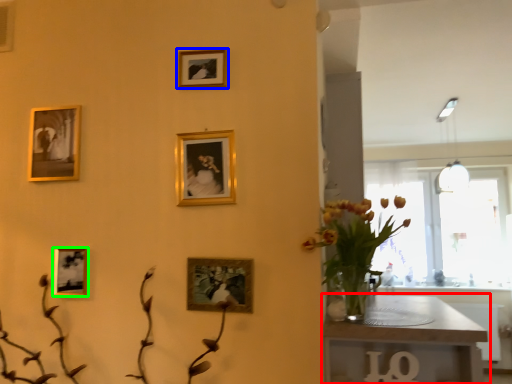
Question: Considering the real-world distances, which object is closest to table (highlighted by a red box)? picture frame (highlighted by a blue box) or picture frame (highlighted by a green box).

Choices:
 (A) picture frame
 (B) picture frame

Answer: (A)